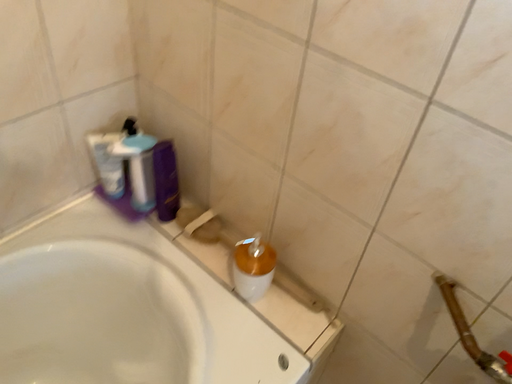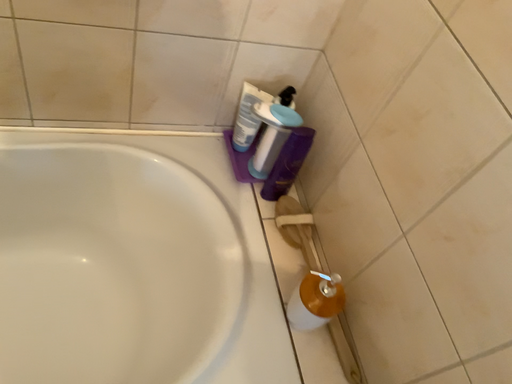
Question: Which way did the camera rotate in the video?

Choices:
 (A) rotated right
 (B) rotated left

Answer: (B)